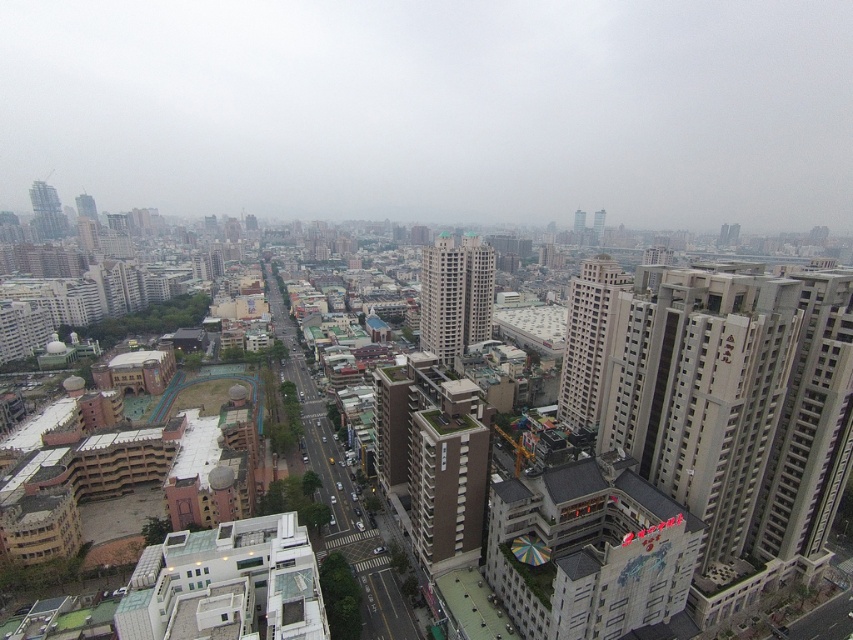
Based on the photo, how much distance is there between transparent glass sky at upper center and metallic glass skyscraper at left?

A distance of 201.81 meters exists between transparent glass sky at upper center and metallic glass skyscraper at left.

Is transparent glass sky at upper center taller than metallic glass skyscraper at left?

Yes.

Between point (372, 93) and point (38, 218), which one is positioned behind?

The point (372, 93) is behind.

Locate an element on the screen. The width and height of the screenshot is (853, 640). transparent glass sky at upper center is located at coordinates (436, 109).

Which is behind, point (567, 323) or point (581, 218)?

The point (581, 218) is behind.

Does point (567, 392) come closer to viewer compared to point (578, 241)?

That is True.

At what (x,y) coordinates should I click in order to perform the action: click on beige concrete building at center-right. Please return your answer as a coordinate pair (x, y). This screenshot has width=853, height=640. Looking at the image, I should click on (589, 339).

Who is positioned more to the right, transparent glass sky at upper center or smooth glass skyscraper at center-right?

Positioned to the right is smooth glass skyscraper at center-right.

Describe the element at coordinates (436, 109) in the screenshot. This screenshot has height=640, width=853. I see `transparent glass sky at upper center` at that location.

Which is in front, point (155, 51) or point (595, 225)?

Point (595, 225) is more forward.

The height and width of the screenshot is (640, 853). I want to click on transparent glass sky at upper center, so click(436, 109).